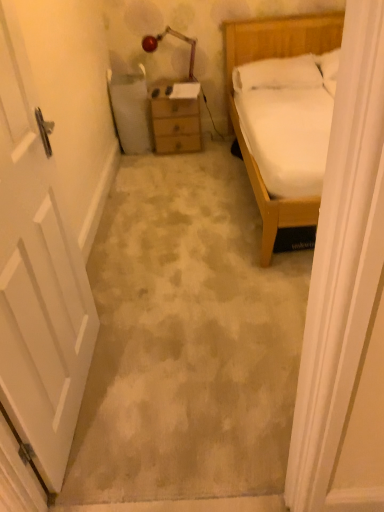
The width and height of the screenshot is (384, 512). Find the location of `free area in between white matte door at left and wooden chest of drawers at center`. free area in between white matte door at left and wooden chest of drawers at center is located at coordinates (147, 237).